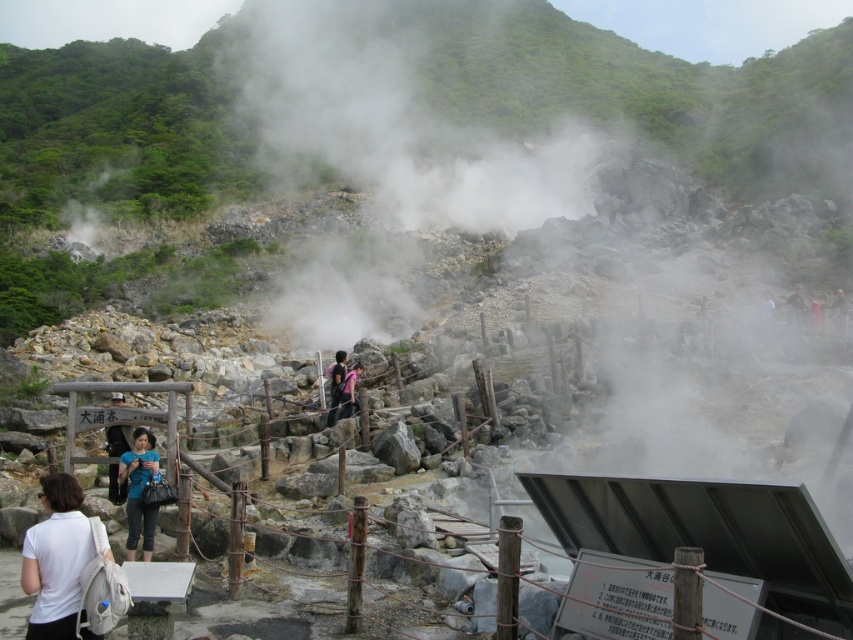
From the picture: You are a park ranger guiding visitors through the geothermal area. You notice two people wearing the dark blue shirt at center and the dark green fabric jacket at upper right. Which person is standing closer to the steam rising from the ground?

The dark blue shirt at center is positioned under the dark green fabric jacket at upper right, meaning the person in the dark blue shirt at center is closer to the steam rising from the ground.

Consider the image. You are standing on the wooden walkway and see the white fabric backpack at lower left. If you want to reach the backpack, which direction should you move relative to your current position on the walkway?

The white fabric backpack at lower left is located at point [56,560], so you should move towards the lower left direction from your current position on the walkway to reach it.